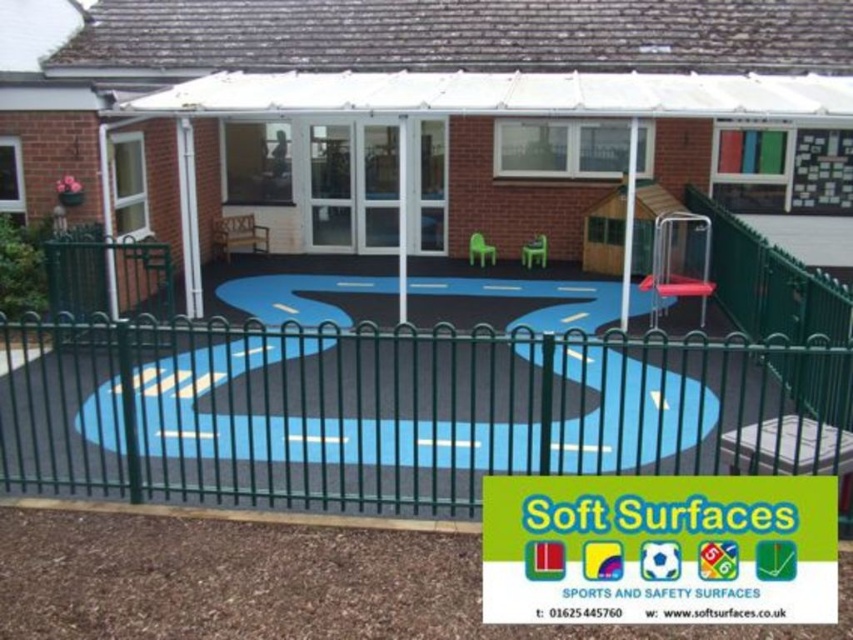
You are standing in the children play area and want to take a photo of both point (169, 456) and point (698, 212). Which point should you focus on first to ensure both are in clear view?

You should focus on point (169, 456) first because it is closer to the camera than point (698, 212), ensuring both points are in focus.

You are standing at the entrance of the play area and want to walk directly towards the green metal fence at center. What direction should you head in?

The green metal fence at center is located at point (401, 410) in 2D coordinates, so you should head towards the center of the play area to reach it.

You are a parent trying to ensure your child stays within the play area. You see the green metal fence at center and the metallic silver swing at center right. Which object is closer to you, and thus better for keeping an eye on your child?

The green metal fence at center is closer to the viewer than the metallic silver swing at center right, so it is better for keeping an eye on your child as it is nearer to you.